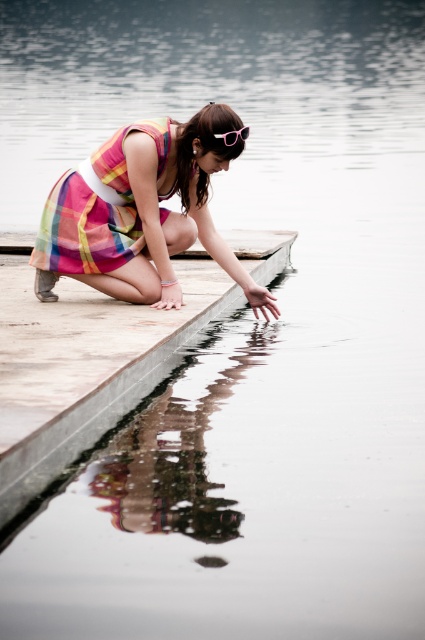
Does concrete dock at center have a greater height compared to pink plastic goggles at center?

Yes, concrete dock at center is taller than pink plastic goggles at center.

Consider the image. Between concrete dock at center and pink plastic goggles at center, which one appears on the left side from the viewer's perspective?

Positioned to the left is concrete dock at center.

The image size is (425, 640). What do you see at coordinates (84, 365) in the screenshot?
I see `concrete dock at center` at bounding box center [84, 365].

Locate an element on the screen. This screenshot has height=640, width=425. concrete dock at center is located at coordinates (84, 365).

Does concrete dock at center have a larger size compared to plaid fabric dress at center?

Yes, concrete dock at center is bigger than plaid fabric dress at center.

Is point (71, 342) positioned before point (33, 252)?

Yes, point (71, 342) is in front of point (33, 252).

Locate an element on the screen. The width and height of the screenshot is (425, 640). concrete dock at center is located at coordinates (84, 365).

Between plaid fabric dress at center and pink plastic goggles at center, which one is positioned lower?

Positioned lower is plaid fabric dress at center.

Measure the distance between point [136,208] and camera.

22.64 feet

The height and width of the screenshot is (640, 425). In order to click on plaid fabric dress at center in this screenshot , I will do `click(144, 211)`.